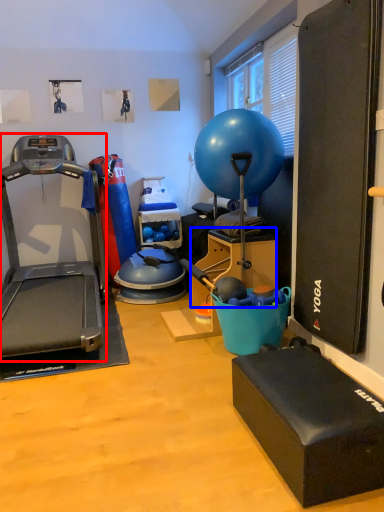
Question: Which point is further to the camera, treadmill (highlighted by a red box) or box (highlighted by a blue box)?

Choices:
 (A) treadmill
 (B) box

Answer: (B)